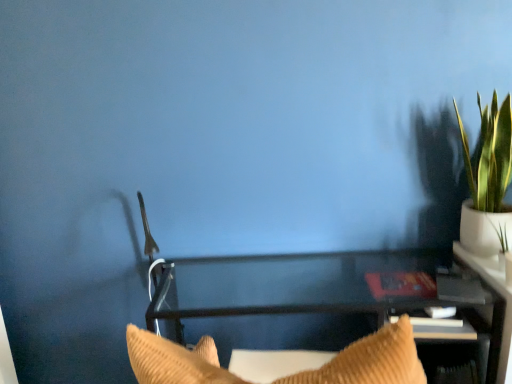
What is the approximate width of green leafy plant in white pot at upper right?

green leafy plant in white pot at upper right is 24.12 centimeters wide.

Image resolution: width=512 pixels, height=384 pixels. Describe the element at coordinates (488, 181) in the screenshot. I see `green leafy plant in white pot at upper right` at that location.

Find the location of `green leafy plant in white pot at upper right`. green leafy plant in white pot at upper right is located at coordinates (488, 181).

Where is `clear glass table at center`? clear glass table at center is located at coordinates (304, 288).

The height and width of the screenshot is (384, 512). What do you see at coordinates (304, 288) in the screenshot?
I see `clear glass table at center` at bounding box center [304, 288].

Find the location of a particular element. The width and height of the screenshot is (512, 384). green leafy plant in white pot at upper right is located at coordinates (488, 181).

Between green leafy plant in white pot at upper right and clear glass table at center, which one appears on the right side from the viewer's perspective?

Positioned to the right is green leafy plant in white pot at upper right.

Which object is further away from the camera, green leafy plant in white pot at upper right or clear glass table at center?

Positioned behind is green leafy plant in white pot at upper right.

Does point (492, 175) lie in front of point (231, 266)?

Yes, point (492, 175) is in front of point (231, 266).

From the image's perspective, relative to clear glass table at center, is green leafy plant in white pot at upper right above or below?

From the image's perspective, green leafy plant in white pot at upper right appears above clear glass table at center.

From a real-world perspective, is green leafy plant in white pot at upper right on top of clear glass table at center?

Yes, from a real-world perspective, green leafy plant in white pot at upper right is above clear glass table at center.

Which object is thinner, green leafy plant in white pot at upper right or clear glass table at center?

green leafy plant in white pot at upper right is thinner.

Between green leafy plant in white pot at upper right and clear glass table at center, which one has more height?

With more height is green leafy plant in white pot at upper right.

Considering the sizes of objects green leafy plant in white pot at upper right and clear glass table at center in the image provided, who is smaller, green leafy plant in white pot at upper right or clear glass table at center?

green leafy plant in white pot at upper right is smaller.

Is green leafy plant in white pot at upper right spatially inside clear glass table at center, or outside of it?

green leafy plant in white pot at upper right is not enclosed by clear glass table at center.

Are green leafy plant in white pot at upper right and clear glass table at center beside each other?

No, green leafy plant in white pot at upper right is not beside clear glass table at center.

Is green leafy plant in white pot at upper right oriented away from clear glass table at center?

No, clear glass table at center is not at the back of green leafy plant in white pot at upper right.

Identify the location of houseplant on the right side of clear glass table at center. The image size is (512, 384). (488, 181).

Can you confirm if clear glass table at center is positioned to the right of green leafy plant in white pot at upper right?

Incorrect, clear glass table at center is not on the right side of green leafy plant in white pot at upper right.

Is clear glass table at center further to the viewer compared to green leafy plant in white pot at upper right?

No, the depth of clear glass table at center is less than that of green leafy plant in white pot at upper right.

Does point (183, 283) come in front of point (507, 98)?

No, (183, 283) is further to viewer.

From the image's perspective, is clear glass table at center located beneath green leafy plant in white pot at upper right?

Correct, clear glass table at center appears lower than green leafy plant in white pot at upper right in the image.

From a real-world perspective, is clear glass table at center located higher than green leafy plant in white pot at upper right?

No.

Between clear glass table at center and green leafy plant in white pot at upper right, which one has larger width?

With larger width is clear glass table at center.

From their relative heights in the image, would you say clear glass table at center is taller or shorter than green leafy plant in white pot at upper right?

Clearly, clear glass table at center is shorter compared to green leafy plant in white pot at upper right.

In terms of size, does clear glass table at center appear bigger or smaller than green leafy plant in white pot at upper right?

Clearly, clear glass table at center is larger in size than green leafy plant in white pot at upper right.

In the scene shown: Is clear glass table at center not within green leafy plant in white pot at upper right?

Indeed, clear glass table at center is completely outside green leafy plant in white pot at upper right.

Is clear glass table at center touching green leafy plant in white pot at upper right?

No, clear glass table at center is not with green leafy plant in white pot at upper right.

Could you tell me if clear glass table at center is facing green leafy plant in white pot at upper right?

No, clear glass table at center is not facing towards green leafy plant in white pot at upper right.

Identify the location of furniture below the green leafy plant in white pot at upper right (from the image's perspective). This screenshot has height=384, width=512. (304, 288).

In order to click on houseplant that is behind the clear glass table at center in this screenshot , I will do `click(488, 181)`.

Where is `houseplant located above the clear glass table at center (from a real-world perspective)`? This screenshot has width=512, height=384. houseplant located above the clear glass table at center (from a real-world perspective) is located at coordinates (488, 181).